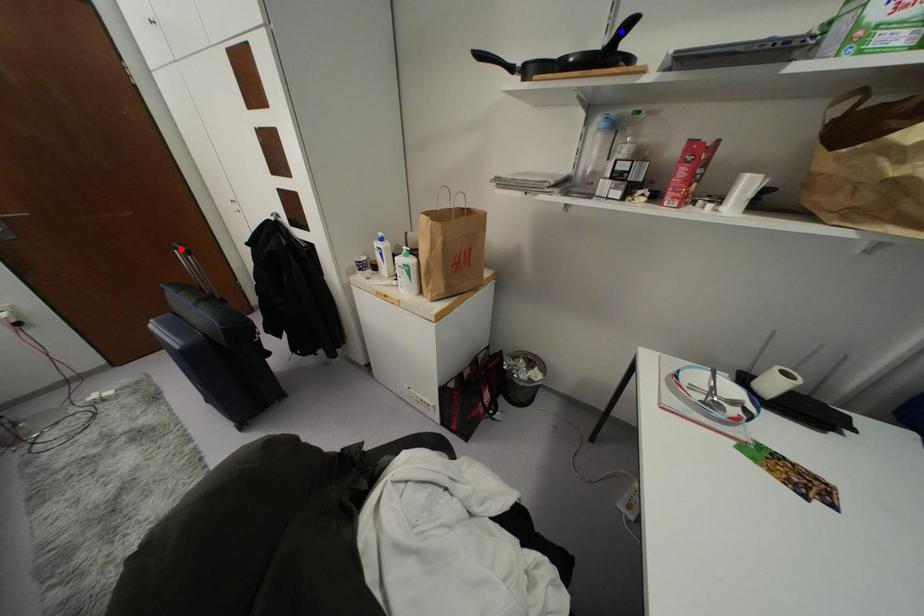
Question: Which of the two points in the image is closer to the camera?

Choices:
 (A) Blue point is closer.
 (B) Red point is closer.

Answer: (A)